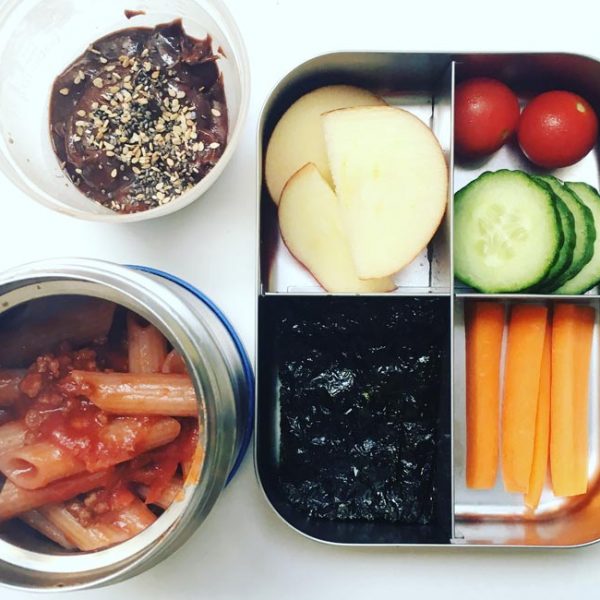
Image resolution: width=600 pixels, height=600 pixels. In order to click on cup in this screenshot , I will do `click(244, 57)`.